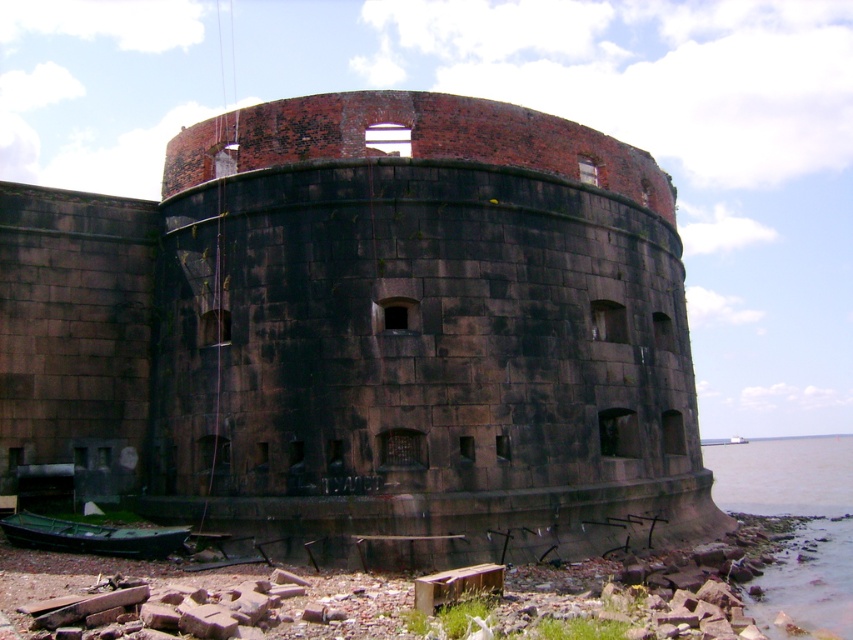
Does dark brick castle at center lie in front of brown water at lower right?

No, dark brick castle at center is further to the viewer.

Does dark brick castle at center appear on the left side of brown water at lower right?

Correct, you'll find dark brick castle at center to the left of brown water at lower right.

Who is more forward, (602,164) or (833,515)?

Positioned in front is point (602,164).

The height and width of the screenshot is (640, 853). I want to click on dark brick castle at center, so click(x=364, y=332).

Does dark brick castle at center lie behind green matte boat at lower left?

Yes, dark brick castle at center is further from the viewer.

Does dark brick castle at center appear under green matte boat at lower left?

No.

Does point (328, 282) come behind point (120, 532)?

Yes, it is.

In order to click on dark brick castle at center in this screenshot , I will do `click(364, 332)`.

Does brown water at lower right appear on the left side of green matte boat at lower left?

In fact, brown water at lower right is to the right of green matte boat at lower left.

Can you confirm if brown water at lower right is thinner than green matte boat at lower left?

No.

Locate an element on the screen. This screenshot has height=640, width=853. brown water at lower right is located at coordinates (798, 529).